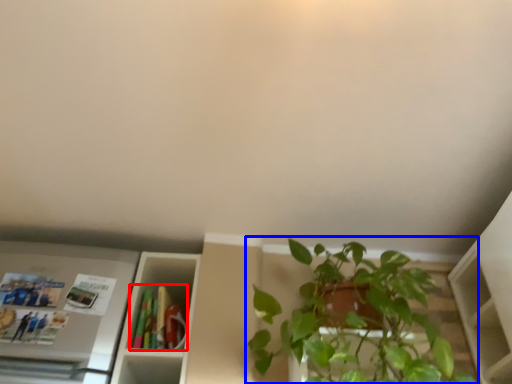
Question: Which of the following is the farthest to the observer, book (highlighted by a red box) or houseplant (highlighted by a blue box)?

Choices:
 (A) book
 (B) houseplant

Answer: (A)